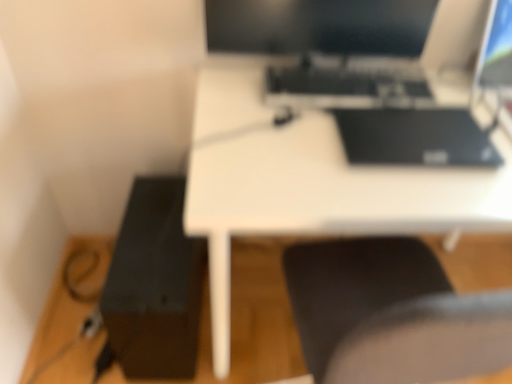
Where is `vacant region above black matte keyboard at center (from a real-world perspective)`? The height and width of the screenshot is (384, 512). vacant region above black matte keyboard at center (from a real-world perspective) is located at coordinates (336, 68).